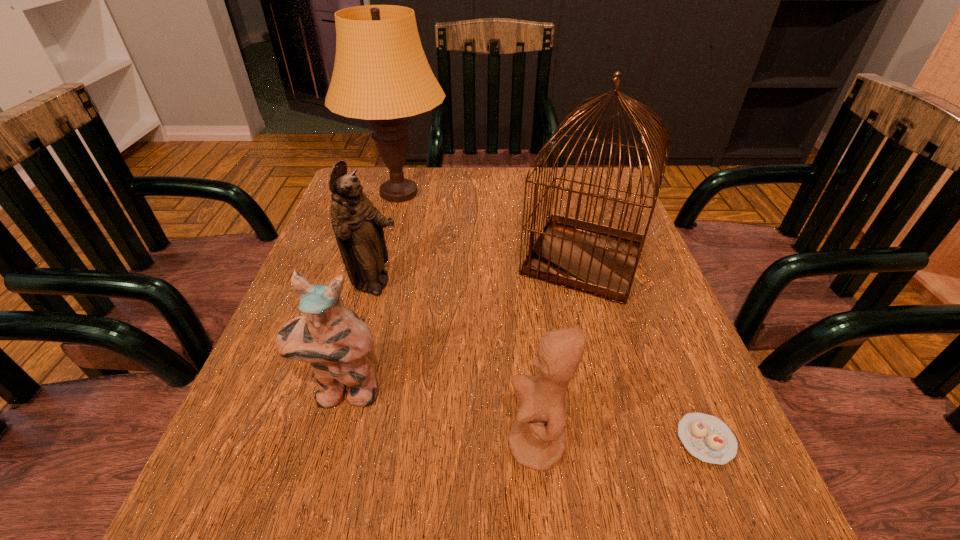
I want to click on lampshade, so click(x=381, y=74).

Locate an element on the screen. This screenshot has width=960, height=540. birdcage is located at coordinates click(x=599, y=260).

Where is `the farthest figurine`? This screenshot has width=960, height=540. the farthest figurine is located at coordinates (358, 226).

Find the location of a particular element. This screenshot has height=540, width=960. the rightmost figurine is located at coordinates (537, 440).

Where is `cupcake`? cupcake is located at coordinates (706, 437).

Locate an element on the screen. The image size is (960, 540). free space located 0.260m on the front of the lampshade is located at coordinates (371, 298).

Identify the location of vacant space located on the front of the birdcage. (622, 395).

You are a GUI agent. You are given a task and a screenshot of the screen. Output one action in this format:
    pyautogui.click(x=<x>, y=<y>)
    Task: Click on the free spot located 0.220m on the front-facing side of the farthest figurine
    The image size is (960, 540).
    Given the screenshot: What is the action you would take?
    pyautogui.click(x=512, y=285)

This screenshot has width=960, height=540. I want to click on vacant space situated 0.140m on the front-facing side of the rightmost figurine, so click(410, 445).

At what (x,y) coordinates should I click in order to perform the action: click on free space located 0.270m on the front-facing side of the rightmost figurine. Please return your answer as a coordinate pair (x, y). This screenshot has width=960, height=540. Looking at the image, I should click on (319, 445).